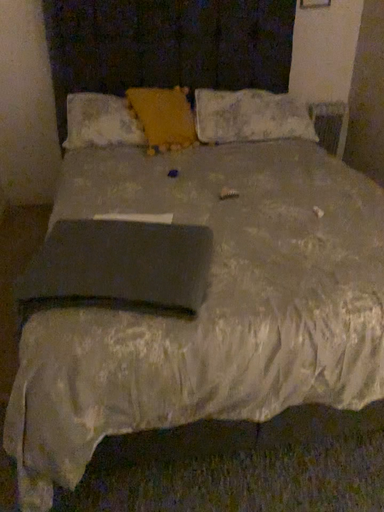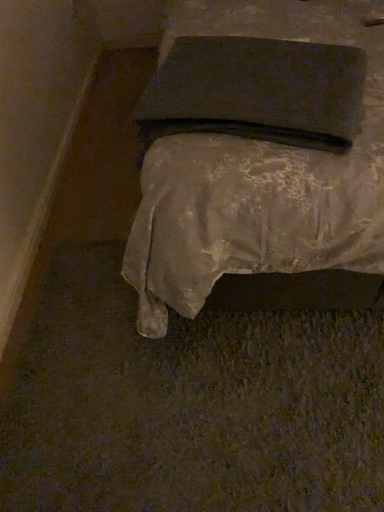
Question: How did the camera likely rotate when shooting the video?

Choices:
 (A) rotated left
 (B) rotated right

Answer: (A)